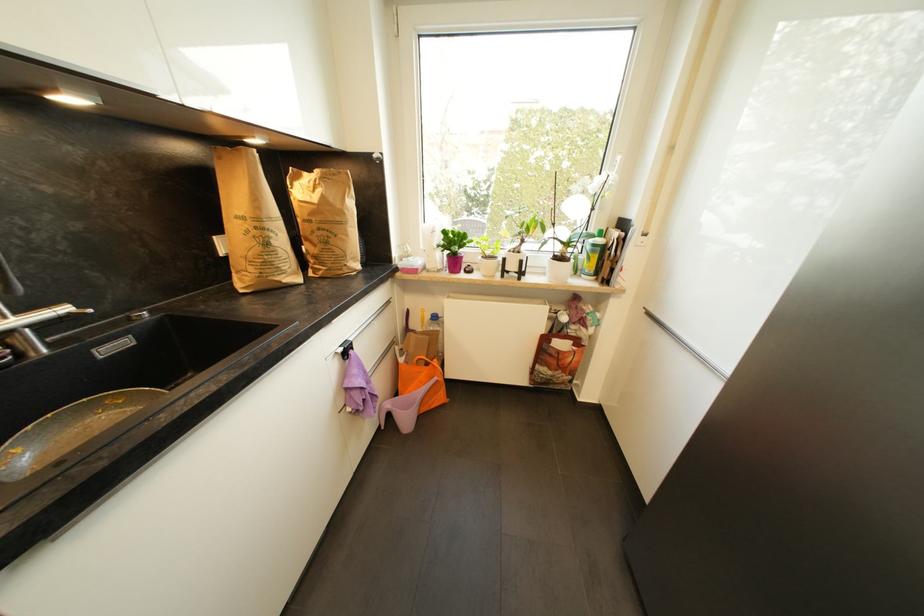
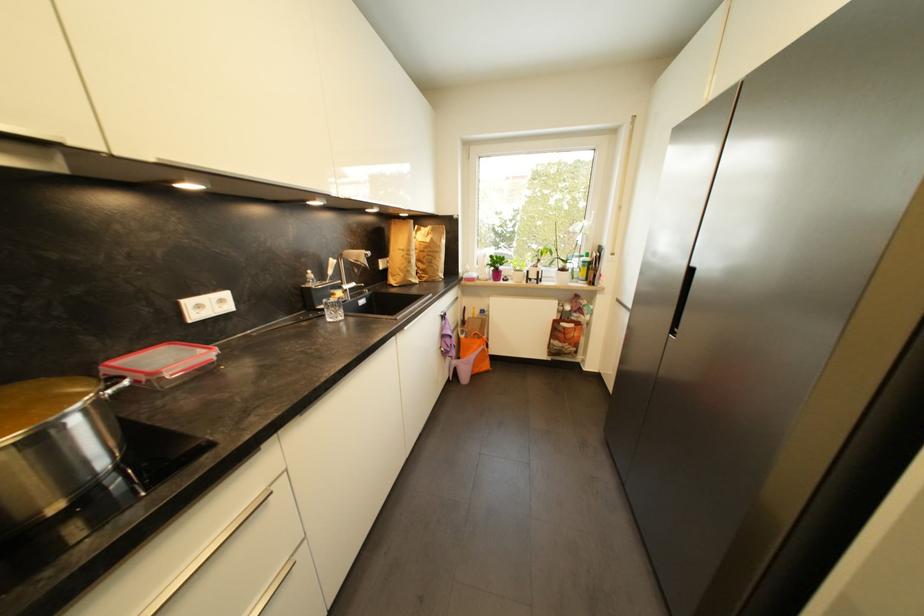
Find the pixel in the second image that matches point (397, 345) in the first image.

(463, 328)